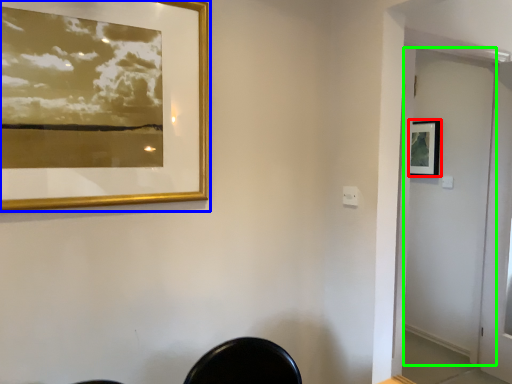
Question: Which is nearer to the picture frame (highlighted by a red box)? picture frame (highlighted by a blue box) or screen door (highlighted by a green box).

Choices:
 (A) picture frame
 (B) screen door

Answer: (B)